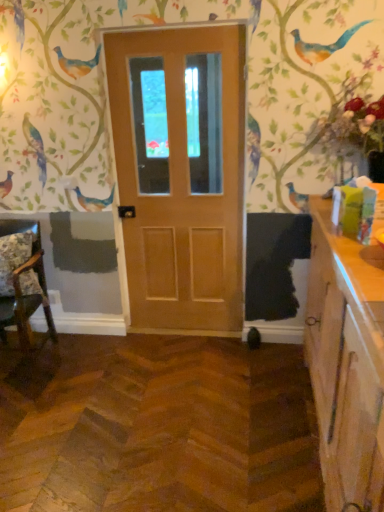
This screenshot has height=512, width=384. Identify the location of free space above matte wood door at center (from a real-world perspective). (167, 30).